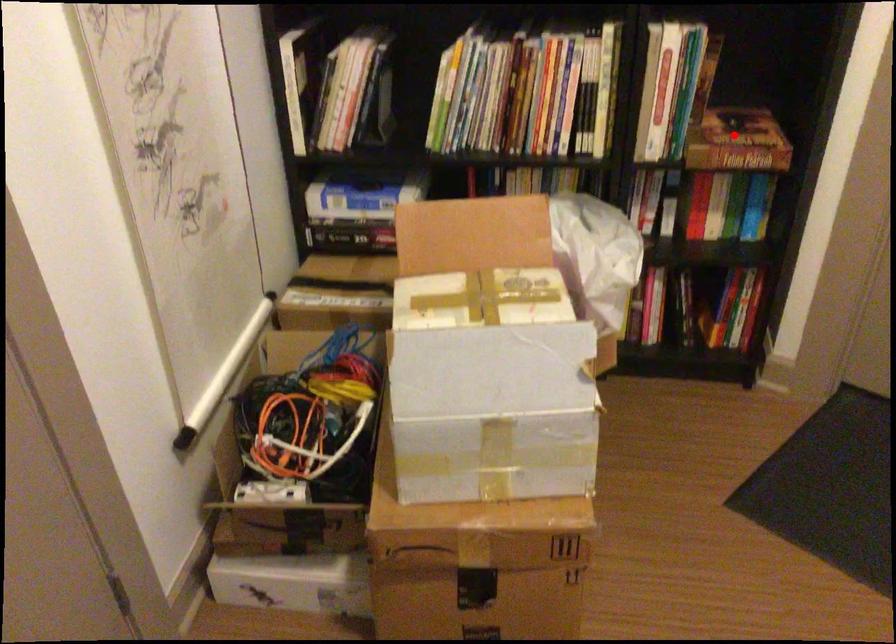
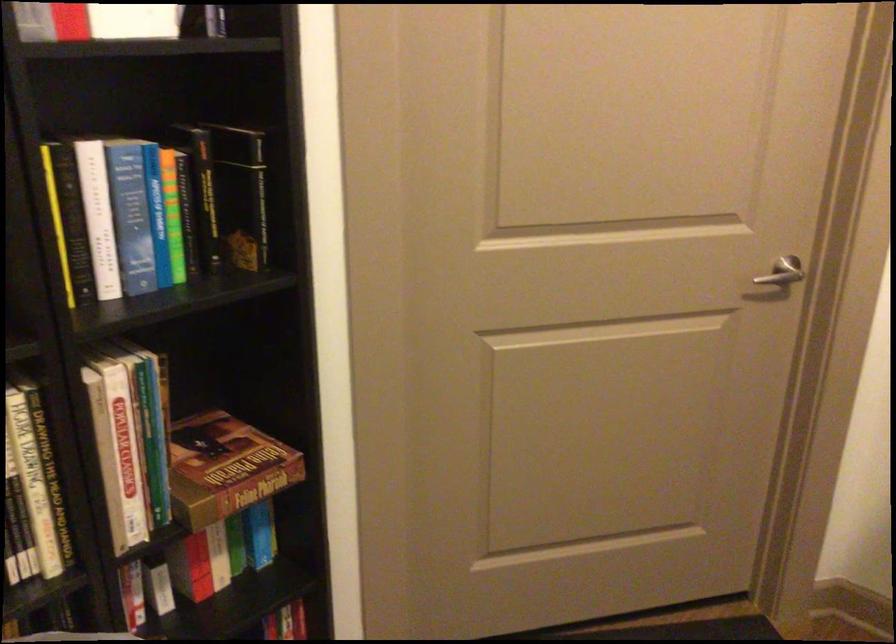
Question: I am providing you with two images of the same scene from different viewpoints. Given a red point in image1, look at the same physical point in image2. Is it:

Choices:
 (A) Closer to the viewpoint
 (B) Farther from the viewpoint

Answer: (A)